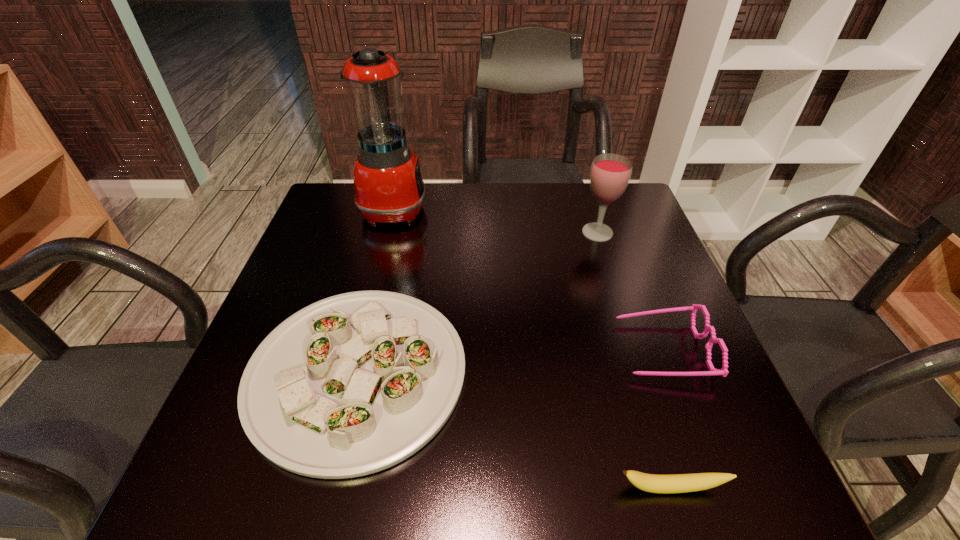
Find the location of a particular element. The width and height of the screenshot is (960, 540). vacant point located between the spectacles and the food processor is located at coordinates (528, 279).

Where is `the third closest object to the banana`? the third closest object to the banana is located at coordinates (610, 174).

This screenshot has height=540, width=960. What are the coordinates of `object that is the fourth nearest to the platter` in the screenshot? It's located at (610, 174).

Locate an element on the screen. free location that satisfies the following two spatial constraints: 1. on the controls of the food processor; 2. on the left side of the platter is located at coordinates (352, 373).

The height and width of the screenshot is (540, 960). In order to click on blank space that satisfies the following two spatial constraints: 1. on the controls of the food processor; 2. on the back side of the wineglass in this screenshot , I will do `click(388, 233)`.

Identify the location of vacant position in the image that satisfies the following two spatial constraints: 1. on the controls of the fourth shortest object; 2. on the left side of the food processor. (388, 233).

The image size is (960, 540). Identify the location of free space that satisfies the following two spatial constraints: 1. on the controls of the tallest object; 2. on the right side of the platter. (352, 373).

Image resolution: width=960 pixels, height=540 pixels. Find the location of `free space that satisfies the following two spatial constraints: 1. on the controls of the tallest object; 2. on the back side of the fourth shortest object`. free space that satisfies the following two spatial constraints: 1. on the controls of the tallest object; 2. on the back side of the fourth shortest object is located at coordinates (388, 233).

The width and height of the screenshot is (960, 540). What are the coordinates of `vacant area that satisfies the following two spatial constraints: 1. on the controls of the platter; 2. on the left side of the tallest object` in the screenshot? It's located at (352, 373).

This screenshot has width=960, height=540. I want to click on vacant space that satisfies the following two spatial constraints: 1. on the back side of the second tallest object; 2. on the controls of the food processor, so click(x=589, y=208).